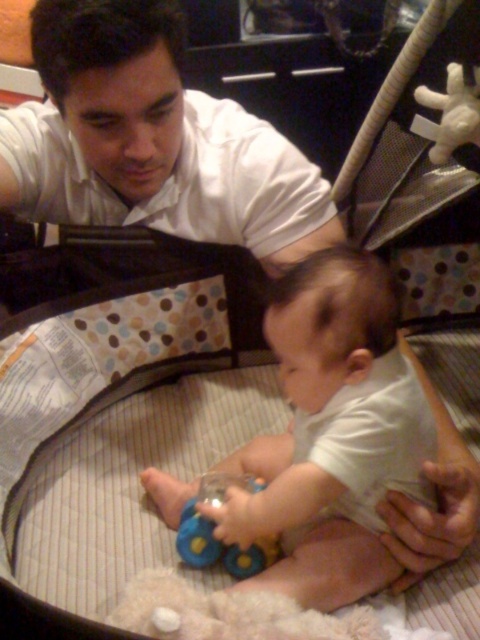
You are a photographer trying to capture a photo of the baby holding the blue rubber toy at center. To ensure the white smooth shirt at upper left does not block the view, where should you position yourself relative to the playpen?

You should position yourself to the right side of the playpen, as the white smooth shirt at upper left is on the left side of the blue rubber toy at center, so moving to the right would keep the shirt out of the way.

You are a photographer trying to capture a candid shot of the white matte baby at center and the blue rubber toy at center. To ensure both are in frame, you need to know their positions relative to each other. Which object is positioned to the right side?

The white matte baby at center is to the right of the blue rubber toy at center according to the description.